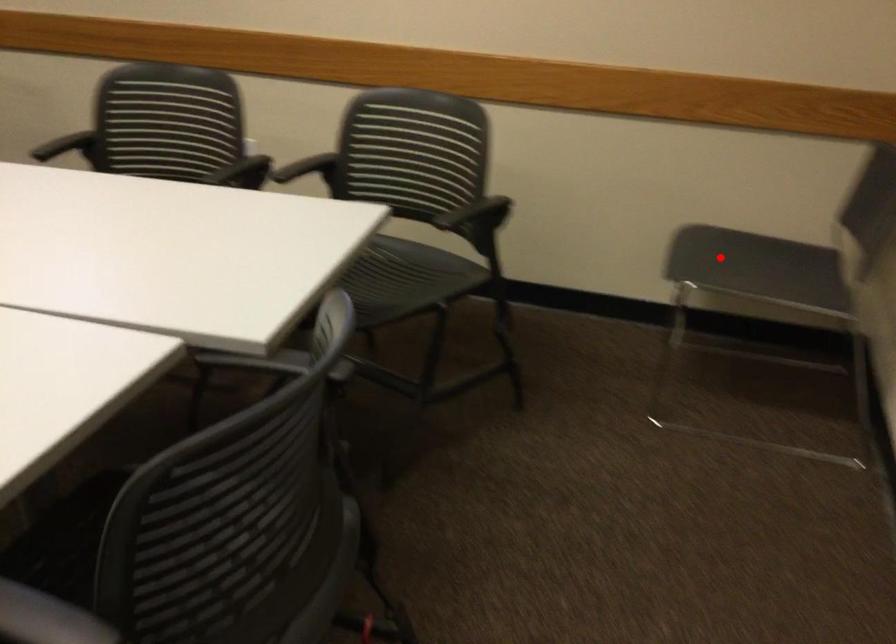
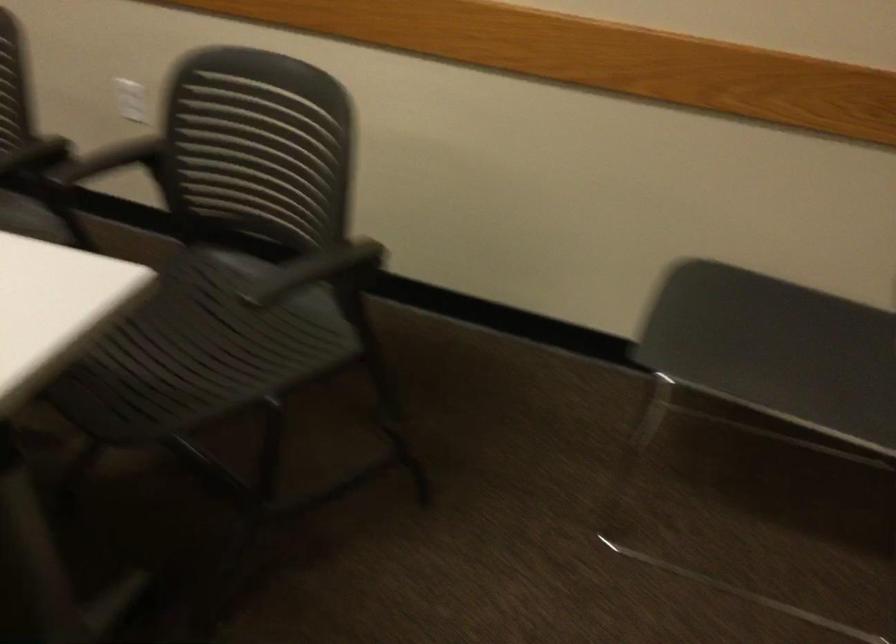
Question: I am providing you with two images of the same scene from different viewpoints. A red point is marked on the first image. Is the red point's position out of view in image 2?

Choices:
 (A) Yes
 (B) No

Answer: (B)